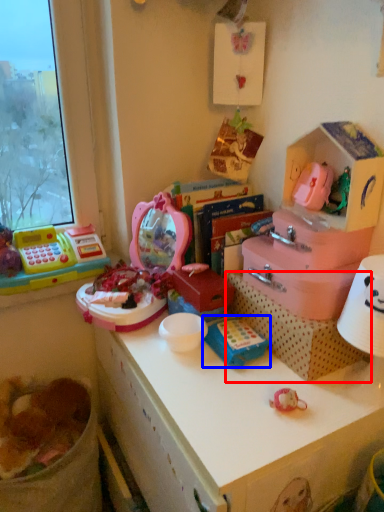
Question: Which of the following is the farthest to the observer, cardboard box (highlighted by a red box) or toy (highlighted by a blue box)?

Choices:
 (A) cardboard box
 (B) toy

Answer: (B)